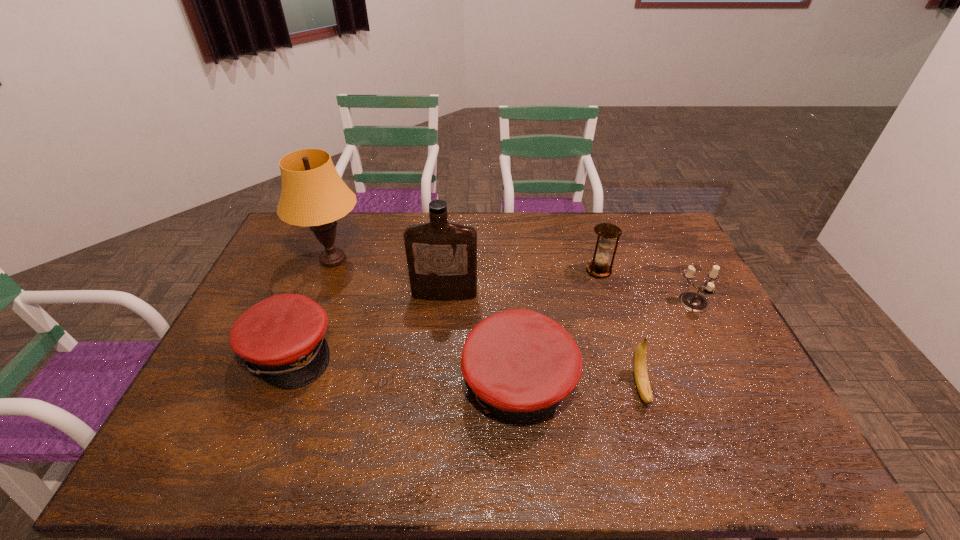
At what (x,y) coordinates should I click in order to perform the action: click on free space between the hourglass and the left cap. Please return your answer as a coordinate pair (x, y). Image resolution: width=960 pixels, height=540 pixels. Looking at the image, I should click on (444, 311).

At what (x,y) coordinates should I click in order to perform the action: click on free spot between the right cap and the rightmost object. Please return your answer as a coordinate pair (x, y). This screenshot has height=540, width=960. Looking at the image, I should click on (607, 344).

Where is `object that stands as the closest to the shorter cap`? This screenshot has width=960, height=540. object that stands as the closest to the shorter cap is located at coordinates (313, 194).

Locate an element on the screen. Image resolution: width=960 pixels, height=540 pixels. object that can be found as the third closest to the taller cap is located at coordinates (607, 232).

At what (x,y) coordinates should I click in order to perform the action: click on free spot that satisfies the following two spatial constraints: 1. on the label side of the liquor; 2. on the left side of the rightmost object. Please return your answer as a coordinate pair (x, y). The height and width of the screenshot is (540, 960). Looking at the image, I should click on (444, 303).

I want to click on free region that satisfies the following two spatial constraints: 1. on the label side of the liquor; 2. on the front-facing side of the shorter cap, so click(440, 352).

The image size is (960, 540). Identify the location of vacant space that satisfies the following two spatial constraints: 1. on the label side of the liquor; 2. on the left side of the candle holder. (444, 303).